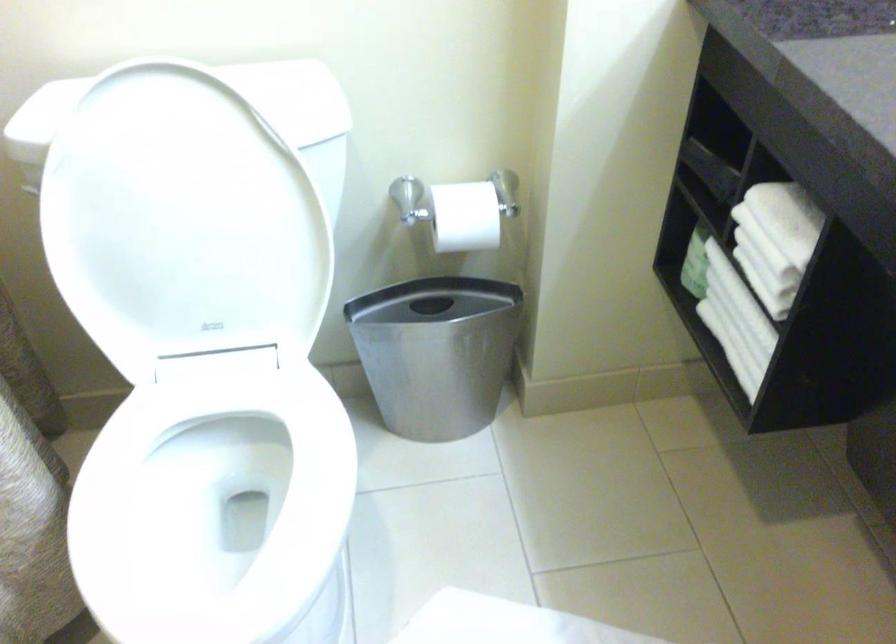
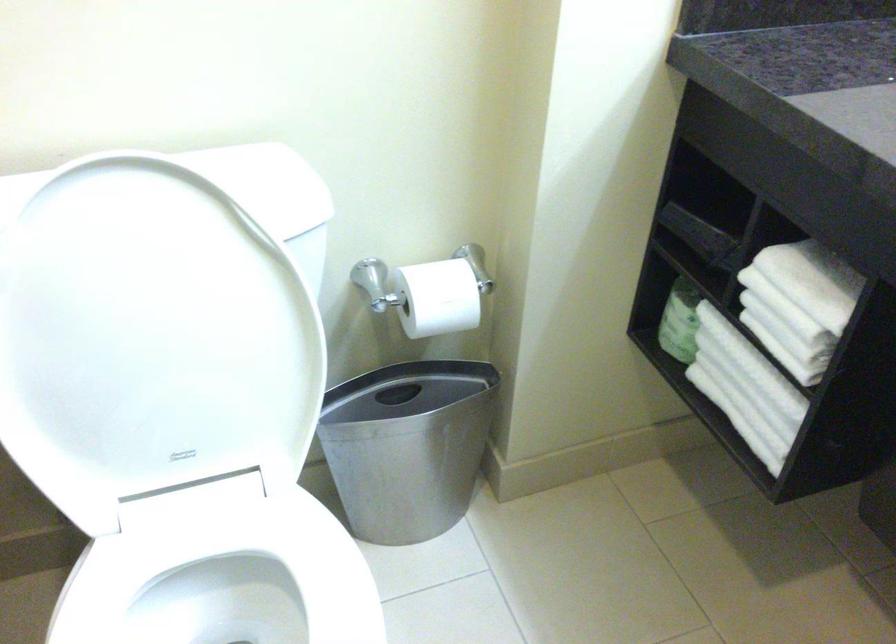
In the second image, find the point that corresponds to point (428, 351) in the first image.

(408, 446)